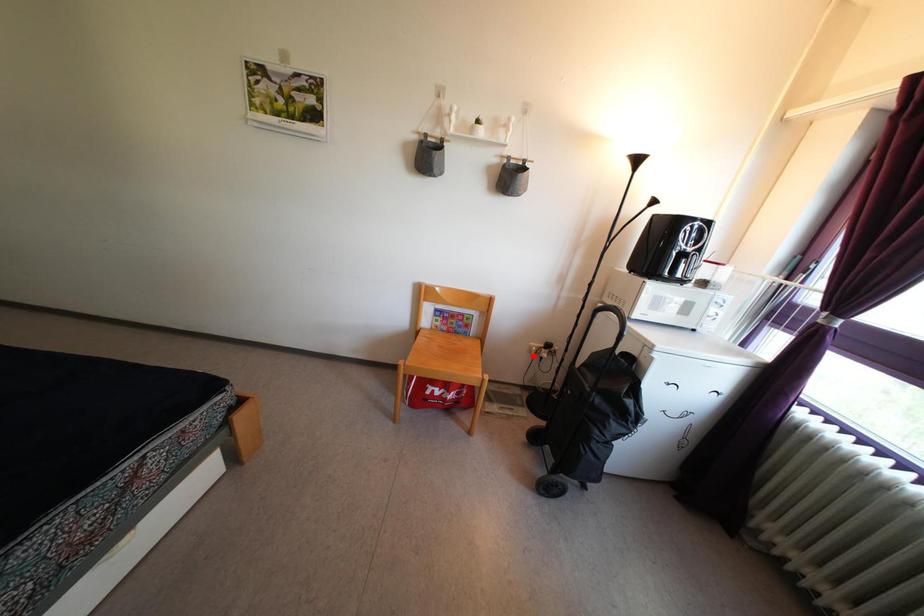
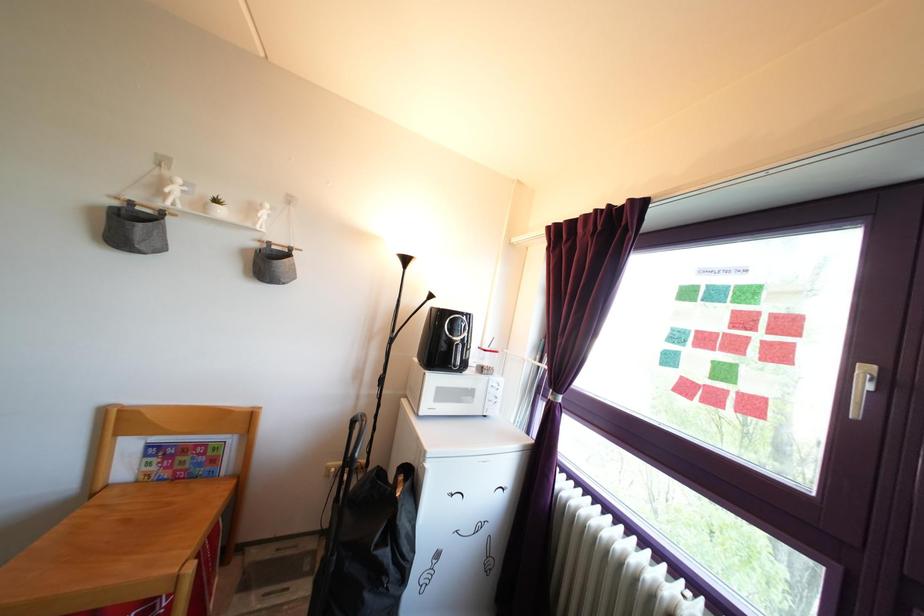
Question: A red point is marked in image1. In image2, is the corresponding 3D point closer to the camera or farther? Reply with the corresponding letter.

Choices:
 (A) The corresponding 3D point is closer.
 (B) The corresponding 3D point is farther.

Answer: (B)